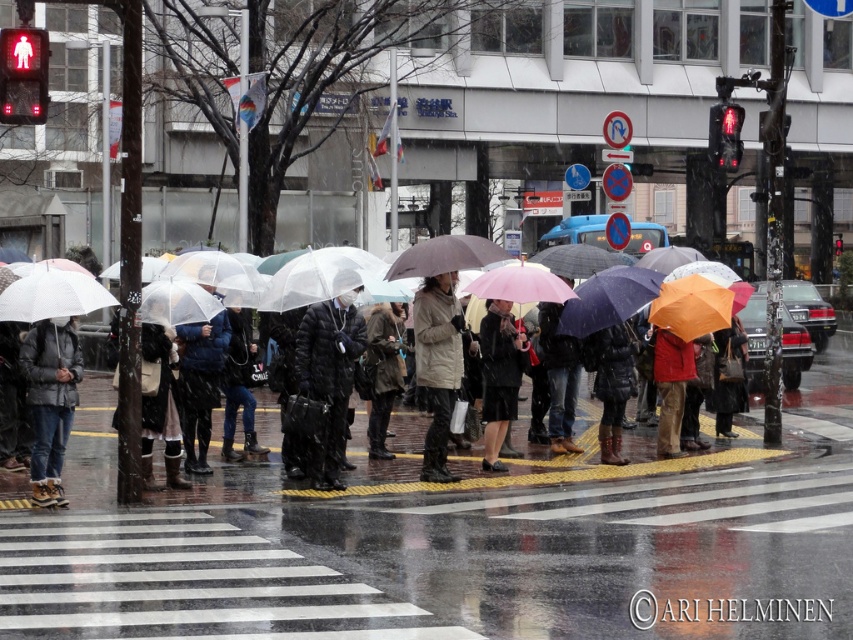
Question: Which point appears closest to the camera in this image?

Choices:
 (A) (366, 358)
 (B) (54, 428)
 (C) (538, 481)
 (D) (305, 371)

Answer: (B)

Question: Is light brown leather boots at center closer to camera compared to matte black coat at center?

Choices:
 (A) yes
 (B) no

Answer: (A)

Question: Is transparent plastic umbrella at center further to the viewer compared to black puffer jacket at center?

Choices:
 (A) yes
 (B) no

Answer: (A)

Question: Is the position of light brown leather boots at center more distant than that of dark green fabric coat at center?

Choices:
 (A) yes
 (B) no

Answer: (B)

Question: Which point is farther to the camera?

Choices:
 (A) (349, 268)
 (B) (47, 328)
 (C) (444, 282)
 (D) (540, 481)

Answer: (D)

Question: Which object is closer to the camera taking this photo?

Choices:
 (A) transparent plastic umbrellas at lower left
 (B) light brown leather boots at center
 (C) black puffer jacket at center
 (D) dark gray leather jacket at left

Answer: (D)